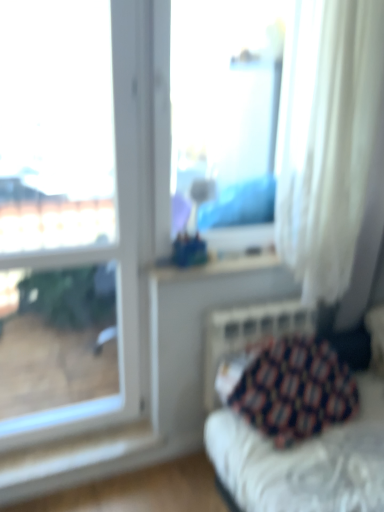
Question: From a real-world perspective, does white sheer curtain at right stand above transparent glass window at upper left, which is the first window from left to right?

Choices:
 (A) no
 (B) yes

Answer: (B)

Question: Does white sheer curtain at right appear on the left side of transparent glass window at upper left, which is counted as the second window, starting from the right?

Choices:
 (A) yes
 (B) no

Answer: (B)

Question: From the image's perspective, is white sheer curtain at right located beneath transparent glass window at upper left, which is the first window from left to right?

Choices:
 (A) no
 (B) yes

Answer: (A)

Question: Is white sheer curtain at right turned away from transparent glass window at upper left, which is the first window from left to right?

Choices:
 (A) yes
 (B) no

Answer: (B)

Question: Does white sheer curtain at right have a larger size compared to transparent glass window at upper left, which is counted as the second window, starting from the right?

Choices:
 (A) no
 (B) yes

Answer: (B)

Question: Considering the positions of patterned fabric cushion at lower right and metallic silver radiator at lower right in the image, is patterned fabric cushion at lower right wider or thinner than metallic silver radiator at lower right?

Choices:
 (A) thin
 (B) wide

Answer: (B)

Question: Is patterned fabric cushion at lower right taller or shorter than metallic silver radiator at lower right?

Choices:
 (A) short
 (B) tall

Answer: (A)

Question: From the image's perspective, is patterned fabric cushion at lower right above or below metallic silver radiator at lower right?

Choices:
 (A) below
 (B) above

Answer: (A)

Question: Relative to metallic silver radiator at lower right, is patterned fabric cushion at lower right in front or behind?

Choices:
 (A) behind
 (B) front

Answer: (B)

Question: Based on their sizes in the image, would you say transparent glass vase at center, which is the 1th window in right-to-left order, is bigger or smaller than metallic silver radiator at lower right?

Choices:
 (A) small
 (B) big

Answer: (A)

Question: Is transparent glass vase at center, marked as the second window in a left-to-right arrangement, taller or shorter than metallic silver radiator at lower right?

Choices:
 (A) tall
 (B) short

Answer: (A)

Question: From the image's perspective, is transparent glass vase at center, which is the 1th window in right-to-left order, located above or below metallic silver radiator at lower right?

Choices:
 (A) above
 (B) below

Answer: (A)

Question: From a real-world perspective, is transparent glass vase at center, which is the 1th window in right-to-left order, above or below metallic silver radiator at lower right?

Choices:
 (A) above
 (B) below

Answer: (A)

Question: Would you say transparent glass window at upper left, which is counted as the second window, starting from the right, is to the left or to the right of patterned fabric cushion at lower right in the picture?

Choices:
 (A) left
 (B) right

Answer: (A)

Question: From the image's perspective, is transparent glass window at upper left, which is counted as the second window, starting from the right, above or below patterned fabric cushion at lower right?

Choices:
 (A) below
 (B) above

Answer: (B)